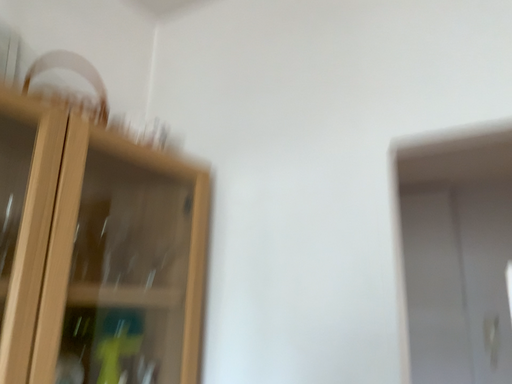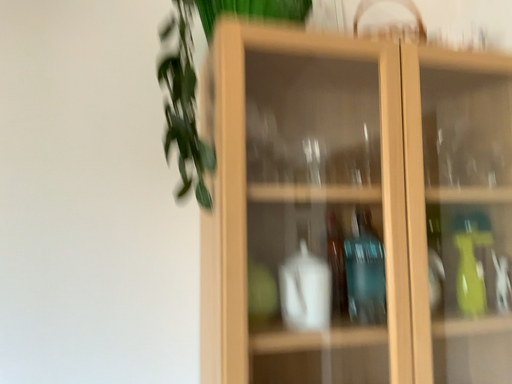
Question: Which way did the camera rotate in the video?

Choices:
 (A) rotated downward
 (B) rotated upward

Answer: (A)